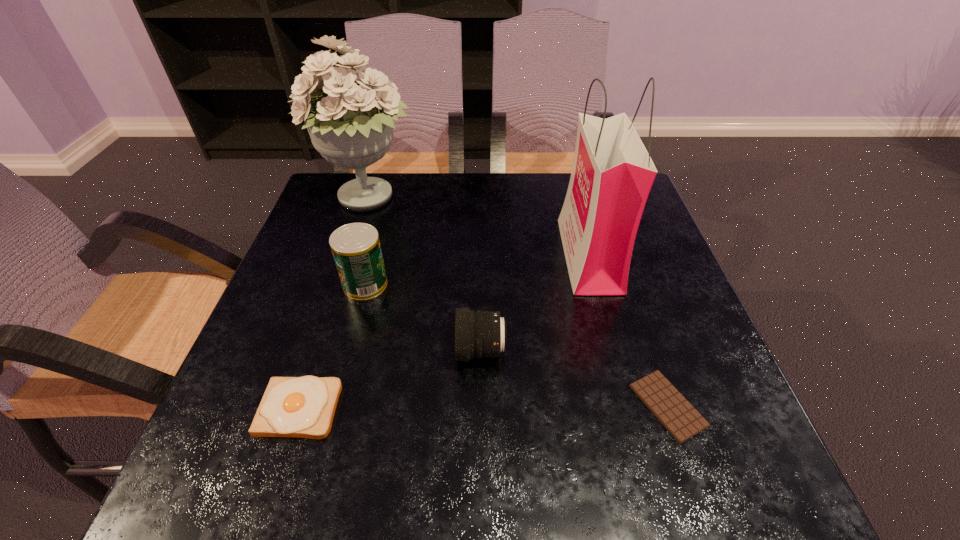
What are the coordinates of `vacant space located on the front-facing side of the shopping bag` in the screenshot? It's located at (492, 255).

Identify the location of vacant space positioned on the right of the fourth shortest object. The width and height of the screenshot is (960, 540). (550, 284).

The image size is (960, 540). I want to click on free space located 0.120m at the front element of the telephoto lens, so click(x=395, y=351).

You are a GUI agent. You are given a task and a screenshot of the screen. Output one action in this format:
    pyautogui.click(x=<x>, y=<y>)
    Task: Click on the free spot located at the front element of the telephoto lens
    The image size is (960, 540).
    Given the screenshot: What is the action you would take?
    pyautogui.click(x=300, y=351)

Locate an element on the screen. vacant area located at the front element of the telephoto lens is located at coordinates (290, 351).

Identify the location of vacant space located on the front of the toast. This screenshot has height=540, width=960. (273, 491).

Locate an element on the screen. The image size is (960, 540). vacant space situated on the left of the shortest object is located at coordinates (571, 406).

Locate an element on the screen. Image resolution: width=960 pixels, height=540 pixels. bouquet that is at the far edge is located at coordinates (351, 126).

Find the location of a particular element. shopping bag at the far edge is located at coordinates (612, 174).

The height and width of the screenshot is (540, 960). Find the location of `object situated at the near edge`. object situated at the near edge is located at coordinates click(676, 414).